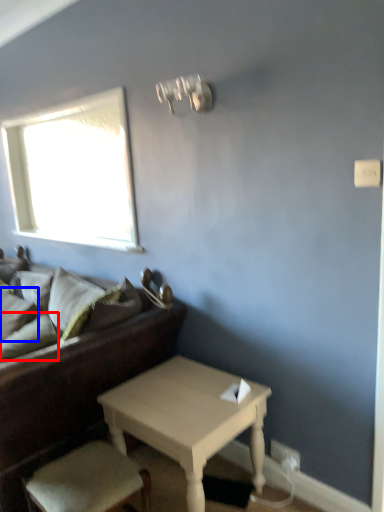
Question: Which object is further to the camera taking this photo, pillow (highlighted by a red box) or pillow (highlighted by a blue box)?

Choices:
 (A) pillow
 (B) pillow

Answer: (B)